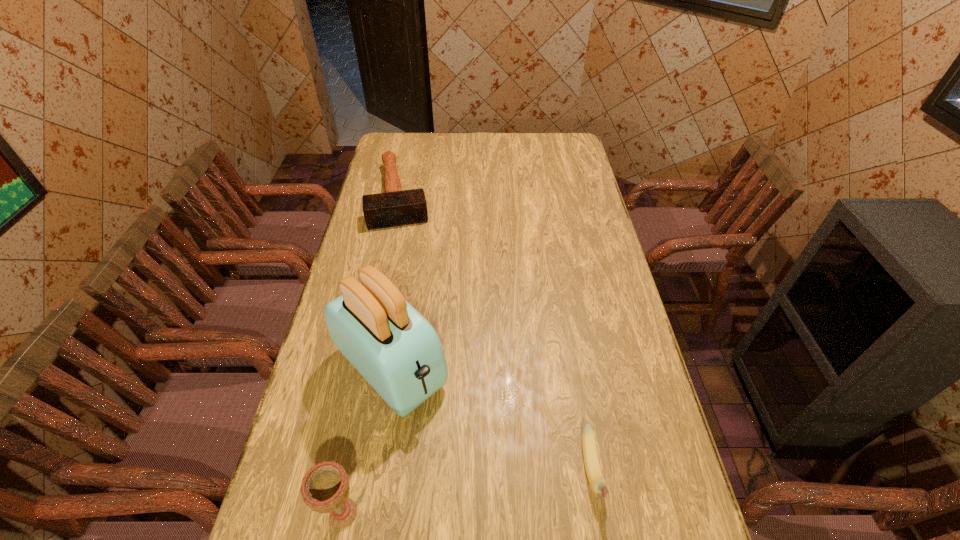
Locate an element on the screen. free space on the desktop that is between the chalice and the banana and is positioned on the side of the second farthest object with the lever is located at coordinates (505, 485).

The image size is (960, 540). I want to click on vacant spot on the desktop that is between the chalice and the banana and is positioned on the striking face of the farthest object, so click(x=448, y=495).